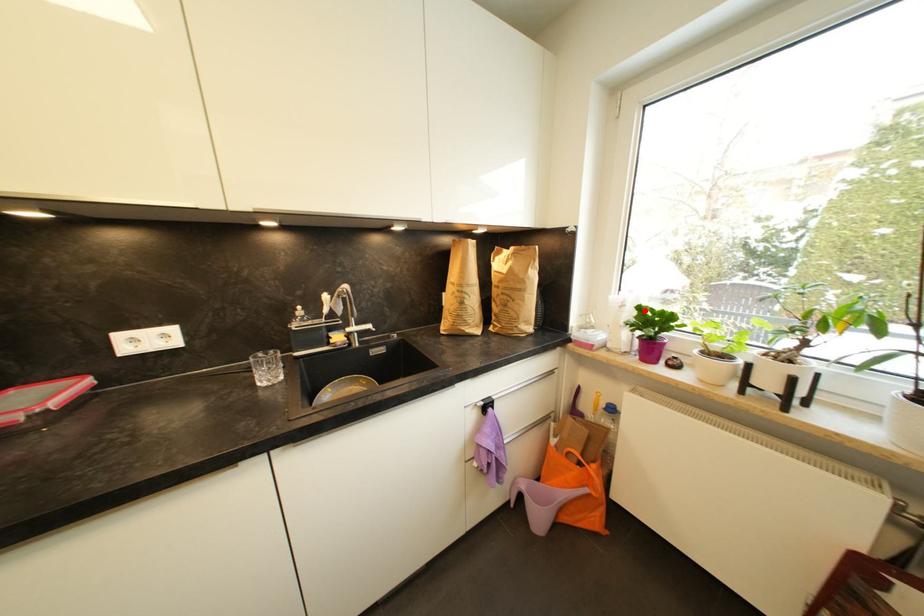
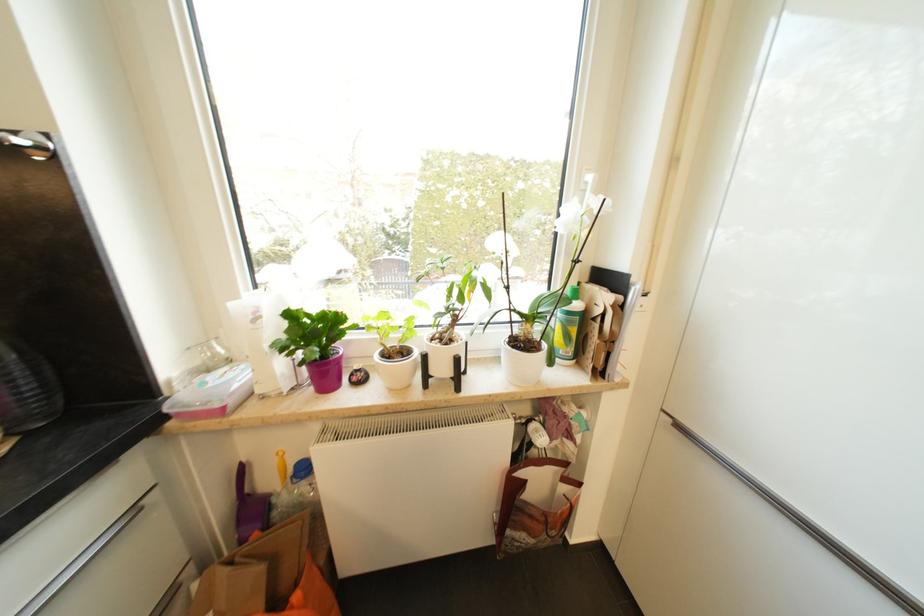
Locate, in the second image, the point that corresponds to the highlighted location in the first image.

(295, 317)